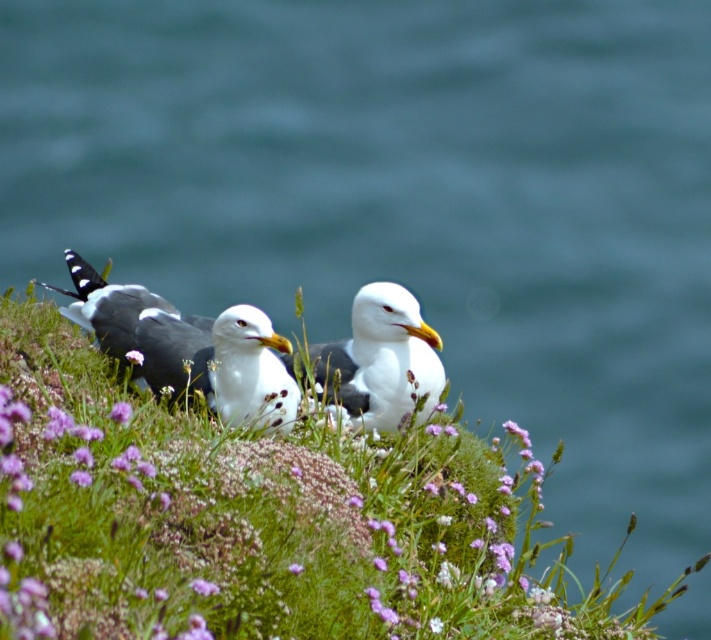
Question: In this image, where is white matte seagull at center located relative to purple matte flower at center?

Choices:
 (A) above
 (B) below

Answer: (B)

Question: Considering the relative positions of white matte seagull at center and purple matte flower at center in the image provided, where is white matte seagull at center located with respect to purple matte flower at center?

Choices:
 (A) below
 (B) above

Answer: (A)

Question: Estimate the real-world distances between objects in this image. Which object is farther from the white speckled feathers at center?

Choices:
 (A) purple matte flower at center
 (B) white matte seagull at center

Answer: (B)

Question: Does white matte seagull at center appear on the left side of purple matte flower at center?

Choices:
 (A) no
 (B) yes

Answer: (A)

Question: Which object is the farthest from the purple matte flower at center?

Choices:
 (A) white feathered seagull at center
 (B) white matte seagull at center

Answer: (A)

Question: Which object is the closest to the white feathered seagull at center?

Choices:
 (A) purple matte flower at center
 (B) purple fuzzy flower at center
 (C) white matte seagull at center

Answer: (C)